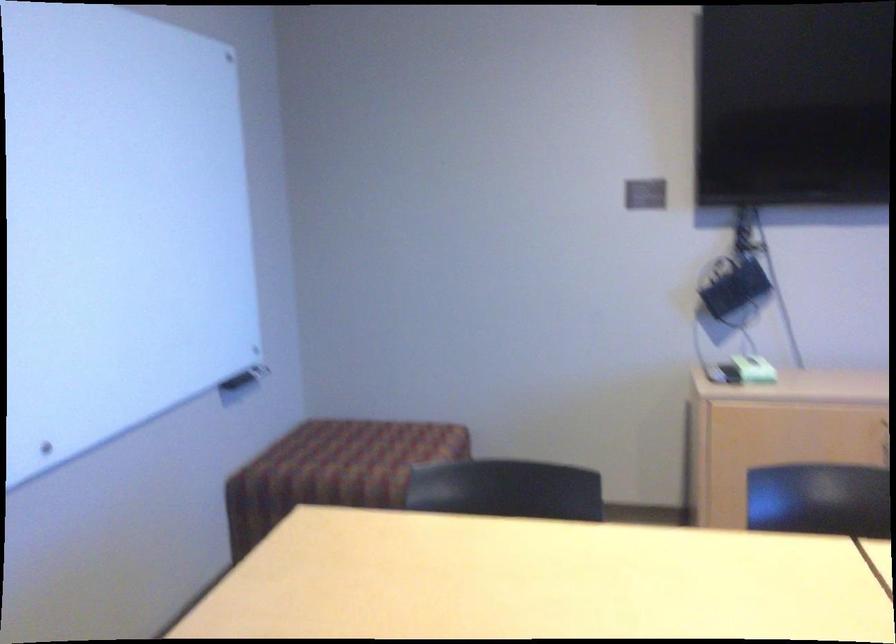
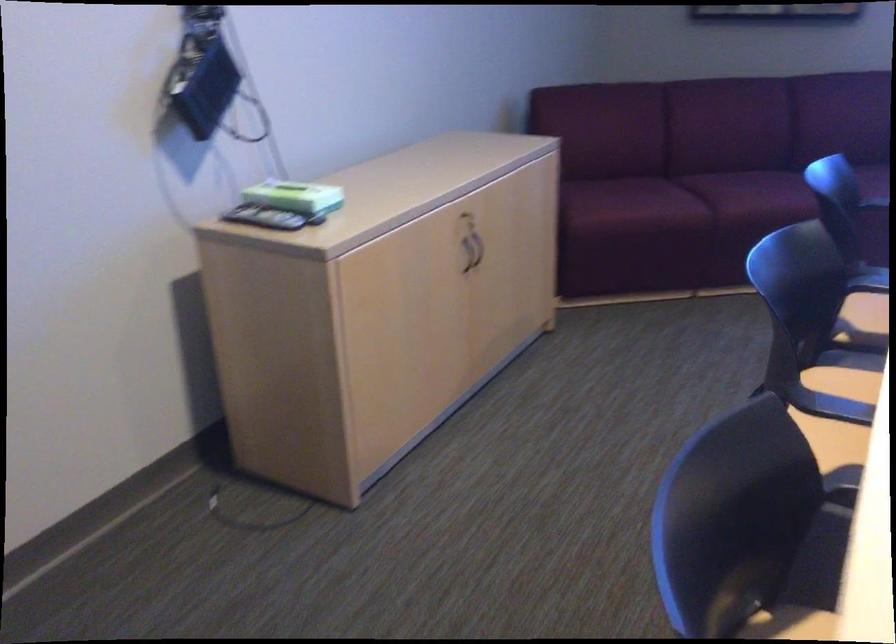
Locate, in the second image, the point that corresponds to (738,363) in the first image.

(287, 196)